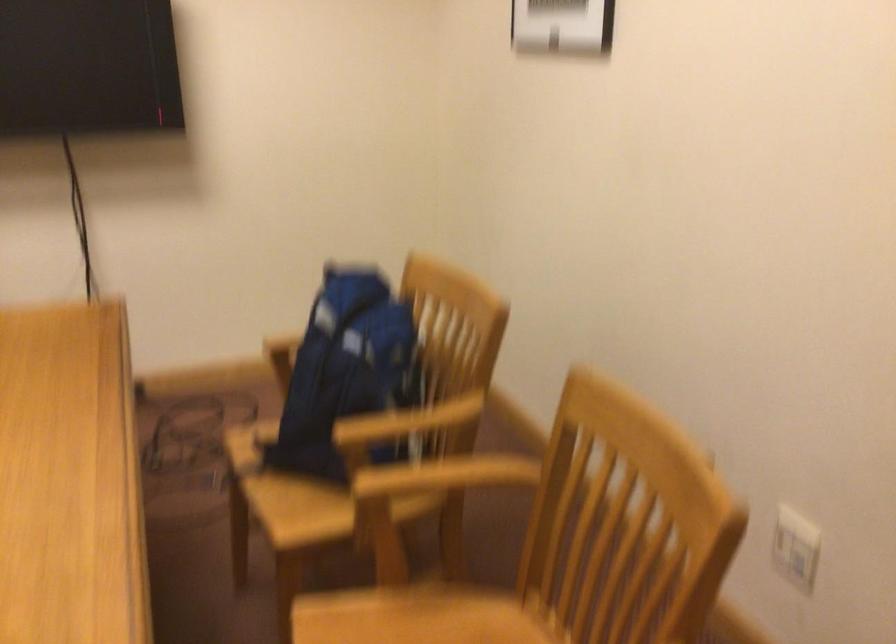
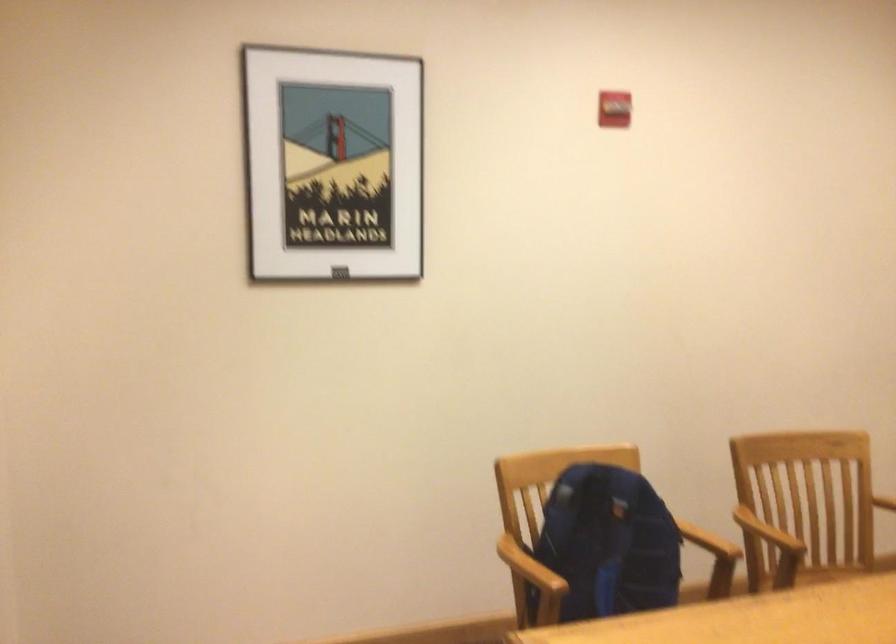
Locate, in the second image, the point that corresponds to point (339, 357) in the first image.

(607, 544)